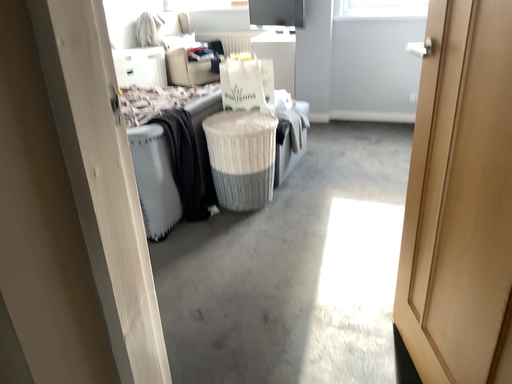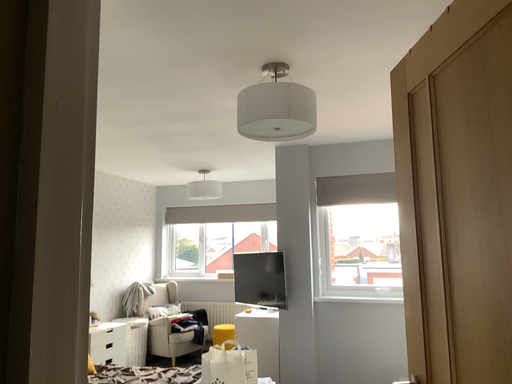
Question: How did the camera likely rotate when shooting the video?

Choices:
 (A) rotated downward
 (B) rotated upward

Answer: (B)